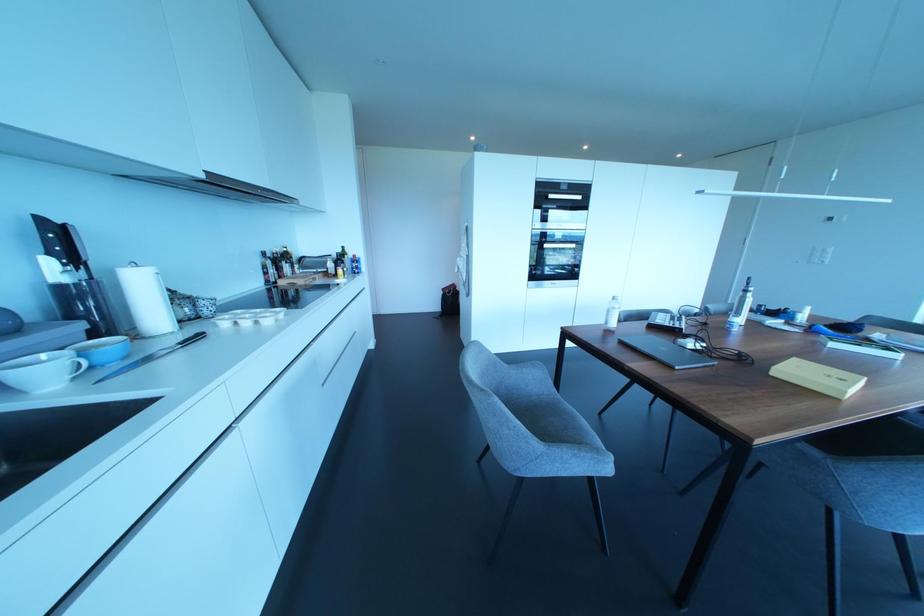
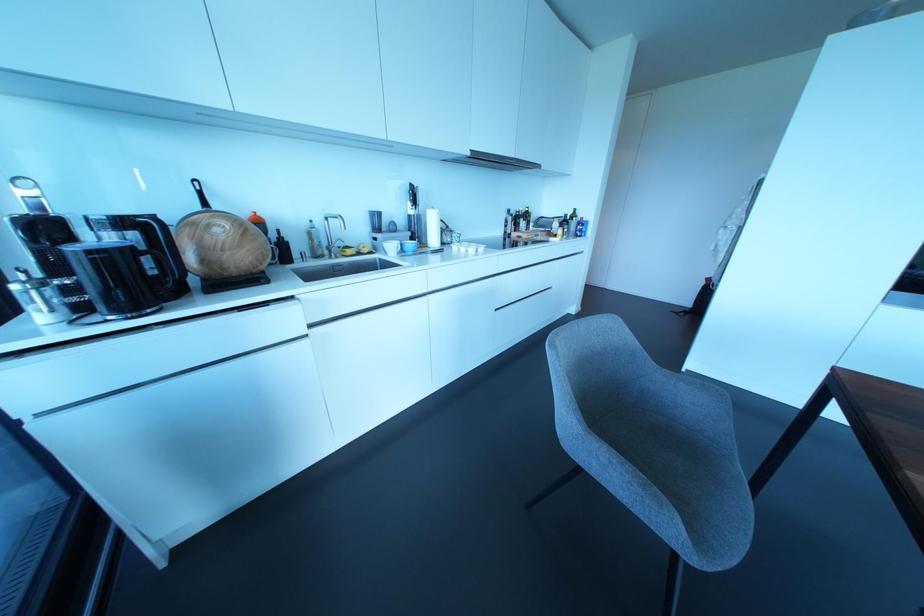
Locate, in the second image, the point that corresponds to [73,378] in the first image.

(397, 253)